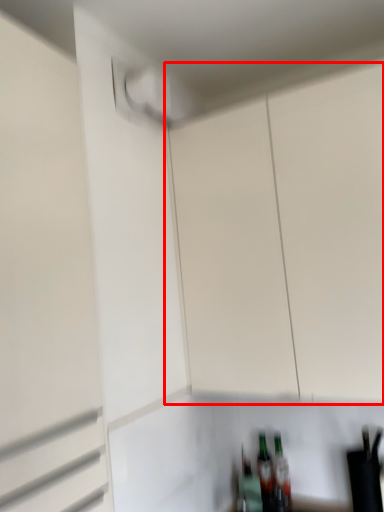
Question: From the image's perspective, where is cabinetry (annotated by the red box) located relative to garage door?

Choices:
 (A) above
 (B) below

Answer: (A)